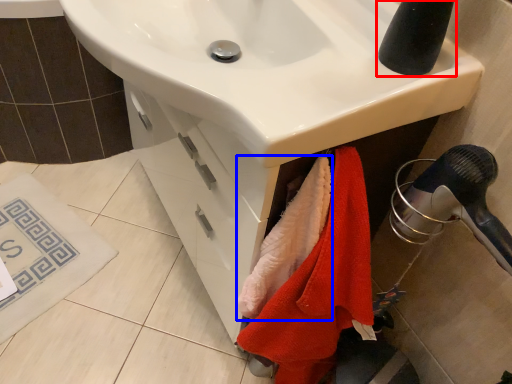
Question: Which object is closer to the camera taking this photo, tap (highlighted by a red box) or beach towel (highlighted by a blue box)?

Choices:
 (A) tap
 (B) beach towel

Answer: (A)